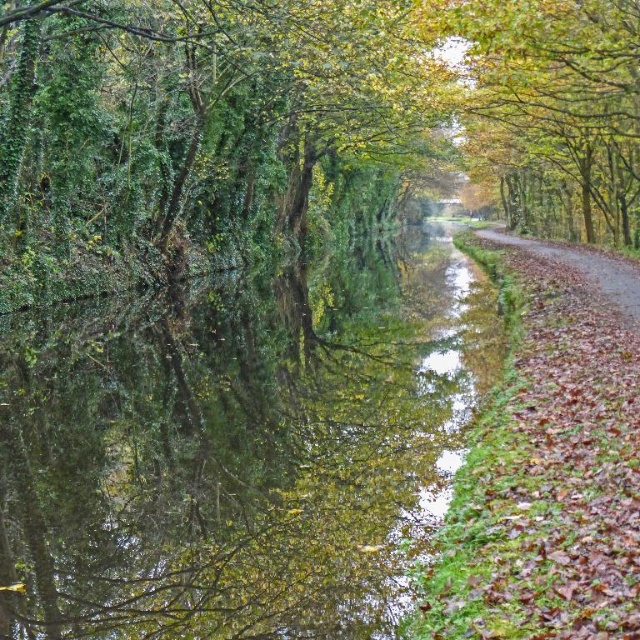
Question: Which point is farther from the camera taking this photo?

Choices:
 (A) (611, 284)
 (B) (609, 144)

Answer: (B)

Question: Is yellow-green leaves at upper center in front of brown dirt road at right?

Choices:
 (A) yes
 (B) no

Answer: (B)

Question: Can you confirm if yellow-green leaves at upper center is thinner than brown dirt road at right?

Choices:
 (A) yes
 (B) no

Answer: (B)

Question: Which point is farther to the camera?

Choices:
 (A) brown dirt road at right
 (B) yellow-green leaves at upper center

Answer: (B)

Question: Does yellow-green leaves at upper center appear under brown dirt road at right?

Choices:
 (A) no
 (B) yes

Answer: (A)

Question: Which object is closer to the camera taking this photo?

Choices:
 (A) brown dirt road at right
 (B) yellow-green leaves at upper center

Answer: (A)